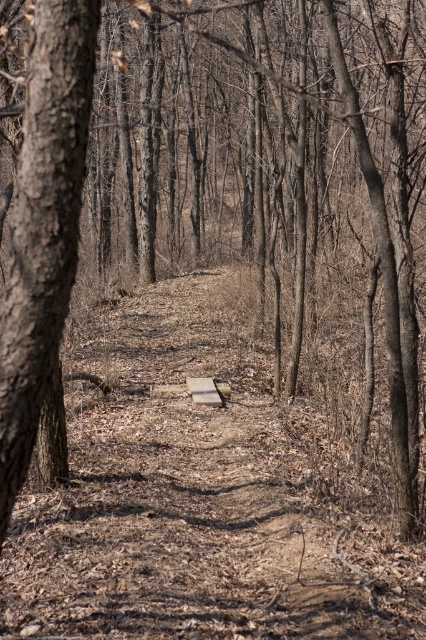
You are a park ranger who needs to place a new sign between the rough bark tree at left and the wooden bench at center. The sign requires a 3 meter space to be placed safely. Is there enough space between them?

The distance between the rough bark tree at left and the wooden bench at center is 7.16 meters, which is more than the required 3 meters. Therefore, there is enough space to place the sign safely between them.

You are a hiker who wants to rest on the wooden bench at center. There is a rough bark tree at left nearby. Which direction should you walk to reach the bench from the tree?

You should walk to the right side to reach the wooden bench at center from the rough bark tree at left because the rough bark tree at left is positioned on the left side of wooden bench at center.

You are standing in the forest and see two points marked on the ground. The first point is at coordinates point (58, 300) and the second is at point (192, 394). Which point is closer to you?

Point (58, 300) is closer to the viewer than point (192, 394).